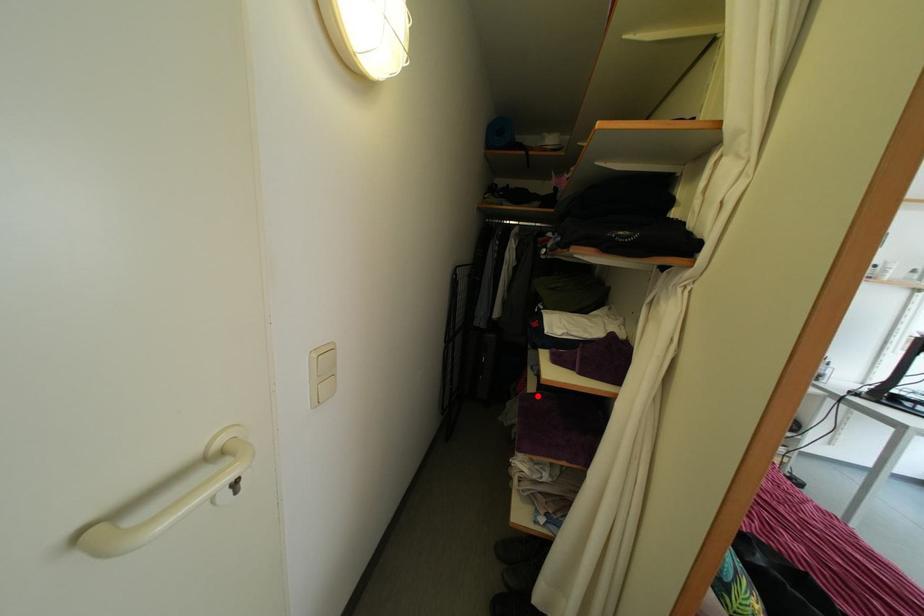
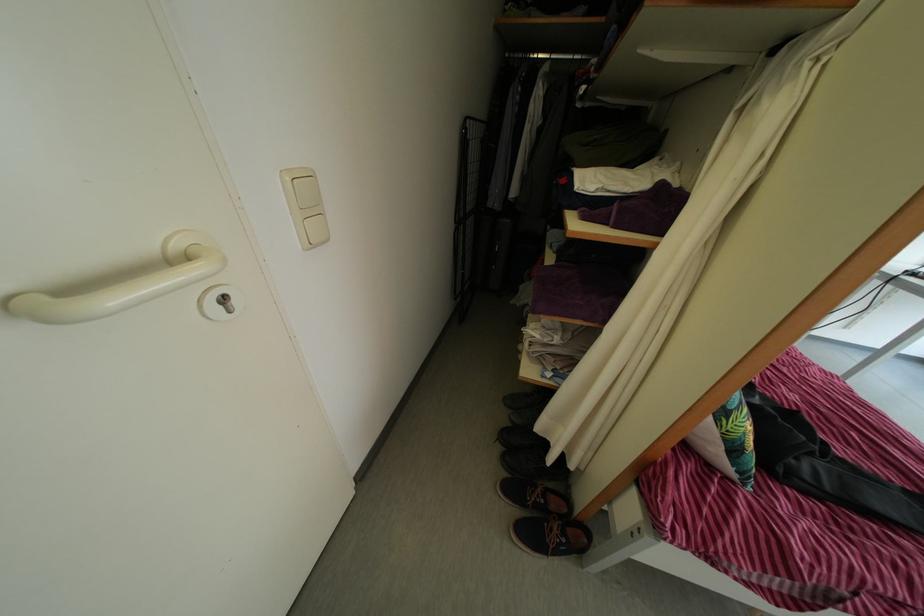
Where in the second image is the point corresponding to the highlighted location from the first image?

(556, 267)